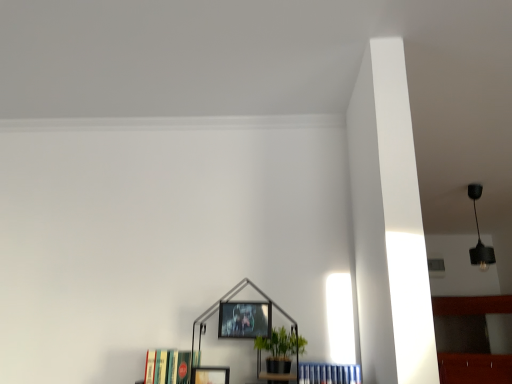
Question: Is black matte pendant light at upper right thinner than green matte plant at center?

Choices:
 (A) yes
 (B) no

Answer: (A)

Question: Is green matte plant at center at the back of black matte pendant light at upper right?

Choices:
 (A) yes
 (B) no

Answer: (B)

Question: Does black matte pendant light at upper right have a greater height compared to green matte plant at center?

Choices:
 (A) yes
 (B) no

Answer: (A)

Question: From the image's perspective, is black matte pendant light at upper right beneath green matte plant at center?

Choices:
 (A) no
 (B) yes

Answer: (A)

Question: Is black matte pendant light at upper right oriented towards green matte plant at center?

Choices:
 (A) yes
 (B) no

Answer: (B)

Question: From a real-world perspective, is metallic silver picture frame at center, positioned as the first picture frame in right-to-left order, above or below hardcover books at lower left, the first book when ordered from left to right?

Choices:
 (A) above
 (B) below

Answer: (A)

Question: Based on their positions, is metallic silver picture frame at center, which is the second picture frame in left-to-right order, located to the left or right of hardcover books at lower left, which is the 2th book from right to left?

Choices:
 (A) left
 (B) right

Answer: (B)

Question: In terms of size, does metallic silver picture frame at center, positioned as the first picture frame in right-to-left order, appear bigger or smaller than hardcover books at lower left, the first book when ordered from left to right?

Choices:
 (A) big
 (B) small

Answer: (B)

Question: Is metallic silver picture frame at center, acting as the 2th picture frame starting from the bottom, inside or outside of hardcover books at lower left, the first book when ordered from left to right?

Choices:
 (A) outside
 (B) inside

Answer: (A)

Question: Is green matte plant at center taller or shorter than black matte pendant light at upper right?

Choices:
 (A) short
 (B) tall

Answer: (A)

Question: Looking at their shapes, would you say green matte plant at center is wider or thinner than black matte pendant light at upper right?

Choices:
 (A) thin
 (B) wide

Answer: (B)

Question: In the image, is green matte plant at center positioned in front of or behind black matte pendant light at upper right?

Choices:
 (A) behind
 (B) front

Answer: (B)

Question: Would you say green matte plant at center is to the left or to the right of black matte pendant light at upper right in the picture?

Choices:
 (A) left
 (B) right

Answer: (A)

Question: Is point (240, 327) closer or farther from the camera than point (274, 331)?

Choices:
 (A) closer
 (B) farther

Answer: (A)

Question: In the image, is metallic silver picture frame at center, acting as the 2th picture frame starting from the bottom, positioned in front of or behind green matte plant at center?

Choices:
 (A) front
 (B) behind

Answer: (B)